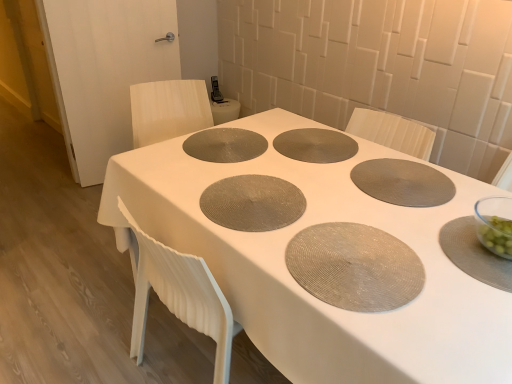
Where is `free spot below matte gray placemat at center right, which ranks as the third pizza pan in left-to-right order (from a real-world perspective)`? free spot below matte gray placemat at center right, which ranks as the third pizza pan in left-to-right order (from a real-world perspective) is located at coordinates (397, 178).